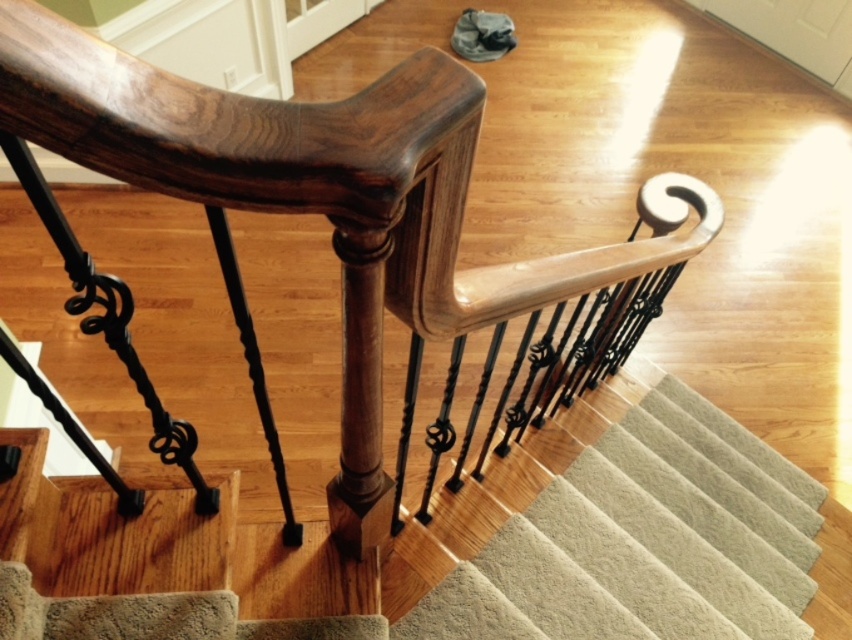
Question: Which of the following is the farthest from the observer?

Choices:
 (A) glossy wood handrail at upper center
 (B) carpeted stairs at center

Answer: (B)

Question: Which object appears farthest from the camera in this image?

Choices:
 (A) glossy wood handrail at upper center
 (B) carpeted stairs at center

Answer: (B)

Question: Can you confirm if glossy wood handrail at upper center is positioned to the left of carpeted stairs at center?

Choices:
 (A) no
 (B) yes

Answer: (B)

Question: Considering the relative positions of glossy wood handrail at upper center and carpeted stairs at center in the image provided, where is glossy wood handrail at upper center located with respect to carpeted stairs at center?

Choices:
 (A) below
 (B) above

Answer: (B)

Question: Can you confirm if glossy wood handrail at upper center is positioned to the right of carpeted stairs at center?

Choices:
 (A) yes
 (B) no

Answer: (B)